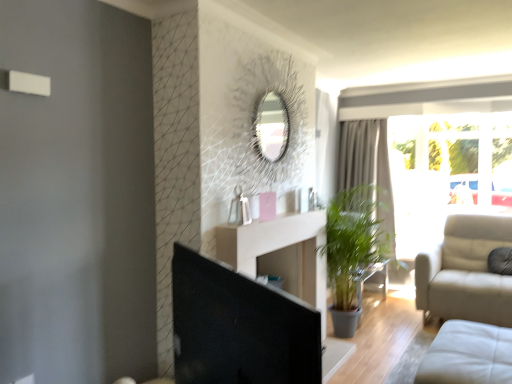
Question: Is black glossy screen door at center to the left or to the right of transparent glass window at right in the image?

Choices:
 (A) left
 (B) right

Answer: (A)

Question: Relative to transparent glass window at right, is black glossy screen door at center in front or behind?

Choices:
 (A) behind
 (B) front

Answer: (B)

Question: Estimate the real-world distances between objects in this image. Which object is farther from the black glossy screen door at center?

Choices:
 (A) white leather studio couch at lower right
 (B) transparent glass window at right
 (C) gray fabric curtain at center

Answer: (C)

Question: Estimate the real-world distances between objects in this image. Which object is closer to the gray fabric curtain at center?

Choices:
 (A) transparent glass window at right
 (B) black glossy screen door at center
 (C) white leather studio couch at lower right

Answer: (A)